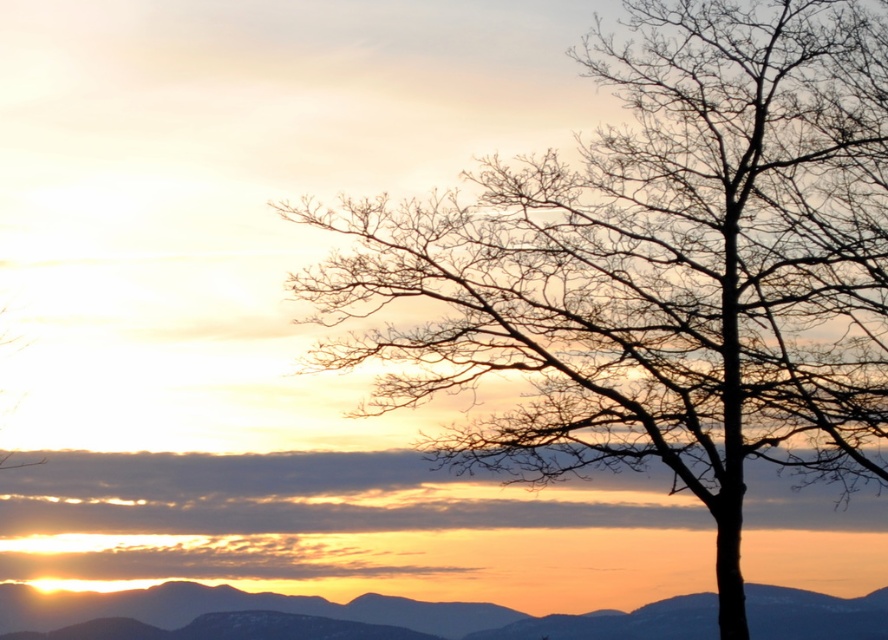
Question: Which object appears farthest from the camera in this image?

Choices:
 (A) silhouette bark tree at right
 (B) silvery metallic mountain at lower left

Answer: (B)

Question: Does silhouette bark tree at right have a greater width compared to silvery metallic mountain at lower left?

Choices:
 (A) no
 (B) yes

Answer: (B)

Question: Does silhouette bark tree at right have a greater width compared to silvery metallic mountain at lower left?

Choices:
 (A) yes
 (B) no

Answer: (A)

Question: Which of the following is the closest to the observer?

Choices:
 (A) silhouette bark tree at right
 (B) silvery metallic mountain at lower left

Answer: (A)

Question: Can you confirm if silhouette bark tree at right is smaller than silvery metallic mountain at lower left?

Choices:
 (A) yes
 (B) no

Answer: (B)